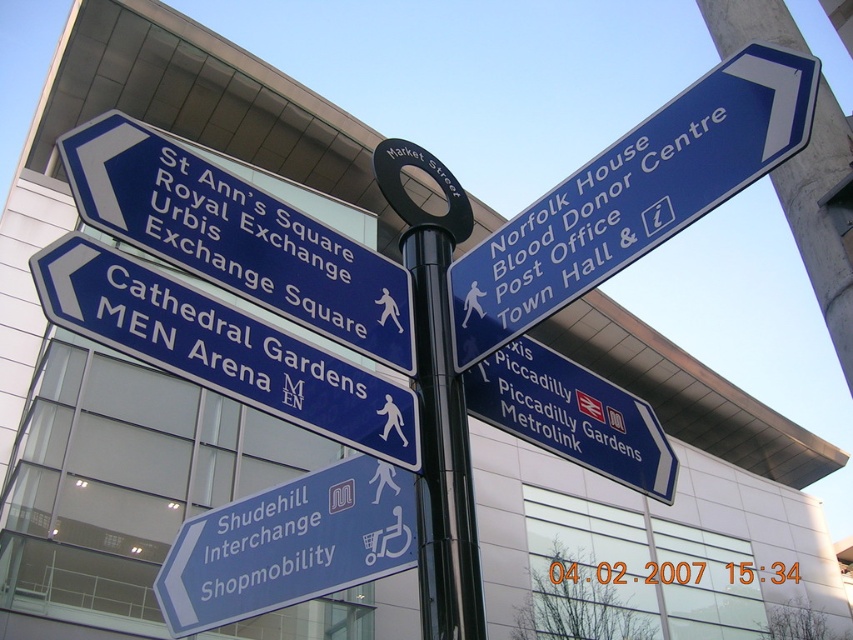
Who is more forward, (213, 552) or (532, 410)?

Point (532, 410) is in front.

In order to click on blue plastic sign at lower left in this screenshot , I will do `click(289, 545)`.

Is blue plastic sign at upper left to the right of blue metallic sign at right from the viewer's perspective?

Incorrect, blue plastic sign at upper left is not on the right side of blue metallic sign at right.

Who is lower down, blue plastic sign at upper left or blue metallic sign at right?

blue metallic sign at right

Does point (403, 333) lie in front of point (521, 401)?

Yes, point (403, 333) is in front of point (521, 401).

Identify the location of blue plastic sign at upper left. 236,237.

Is blue plastic sign at upper right thinner than blue metallic sign at right?

Incorrect, blue plastic sign at upper right's width is not less than blue metallic sign at right's.

Can you confirm if blue plastic sign at upper right is positioned to the right of blue metallic sign at right?

Incorrect, blue plastic sign at upper right is not on the right side of blue metallic sign at right.

Is point (732, 177) closer to viewer compared to point (525, 413)?

Yes, it is.

Identify the location of blue plastic sign at upper right. The height and width of the screenshot is (640, 853). (633, 195).